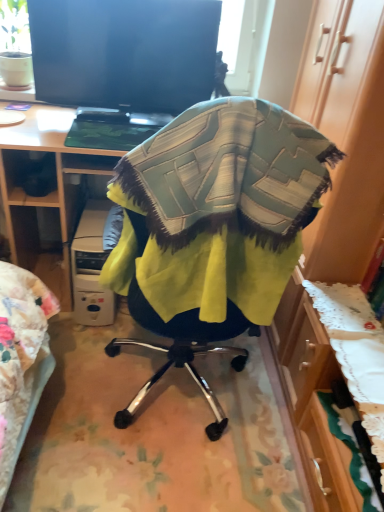
Question: Is the position of wooden desk at center more distant than that of white plastic computer at lower left?

Choices:
 (A) no
 (B) yes

Answer: (A)

Question: Is wooden desk at center not near white plastic computer at lower left?

Choices:
 (A) yes
 (B) no

Answer: (B)

Question: Does wooden desk at center have a lesser height compared to white plastic computer at lower left?

Choices:
 (A) no
 (B) yes

Answer: (A)

Question: Is wooden desk at center at the left side of white plastic computer at lower left?

Choices:
 (A) yes
 (B) no

Answer: (A)

Question: Is wooden desk at center completely or partially outside of white plastic computer at lower left?

Choices:
 (A) yes
 (B) no

Answer: (A)

Question: From the image's perspective, relative to wooden desk at center, is black glossy screen at upper center above or below?

Choices:
 (A) above
 (B) below

Answer: (A)

Question: Considering the positions of black glossy screen at upper center and wooden desk at center in the image, is black glossy screen at upper center wider or thinner than wooden desk at center?

Choices:
 (A) thin
 (B) wide

Answer: (A)

Question: Is black glossy screen at upper center in front of or behind wooden desk at center in the image?

Choices:
 (A) behind
 (B) front

Answer: (A)

Question: Looking at the image, does black glossy screen at upper center seem bigger or smaller compared to wooden desk at center?

Choices:
 (A) small
 (B) big

Answer: (A)

Question: From a real-world perspective, is white plastic computer at lower left above or below wooden desk at center?

Choices:
 (A) below
 (B) above

Answer: (A)

Question: Visually, is white plastic computer at lower left positioned to the left or to the right of wooden desk at center?

Choices:
 (A) right
 (B) left

Answer: (A)

Question: Considering the positions of white plastic computer at lower left and wooden desk at center in the image, is white plastic computer at lower left taller or shorter than wooden desk at center?

Choices:
 (A) short
 (B) tall

Answer: (A)

Question: Considering the positions of white plastic computer at lower left and wooden desk at center in the image, is white plastic computer at lower left bigger or smaller than wooden desk at center?

Choices:
 (A) small
 (B) big

Answer: (A)

Question: From their relative heights in the image, would you say black glossy screen at upper center is taller or shorter than textured fabric chair at center?

Choices:
 (A) tall
 (B) short

Answer: (B)

Question: Do you think black glossy screen at upper center is within textured fabric chair at center, or outside of it?

Choices:
 (A) inside
 (B) outside

Answer: (B)